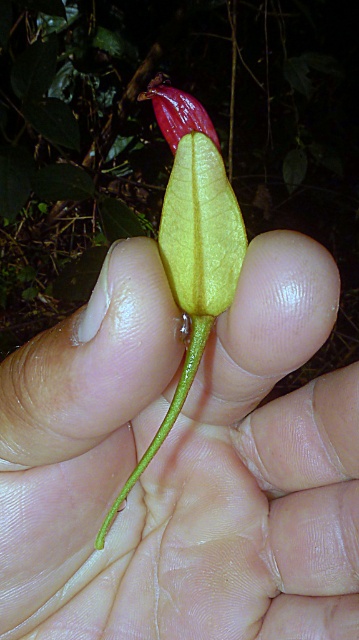
What is the exact coordinate of the yellow matte leaf at center in the image?

The yellow matte leaf at center is located at point (x=165, y=140).

You are a photographer trying to focus on two points in the image. The first point is at coordinates point (x=197, y=342) and the second is at point (x=194, y=99). Which point is closer to your camera lens?

Point (x=197, y=342) is closer to the camera lens than point (x=194, y=99).